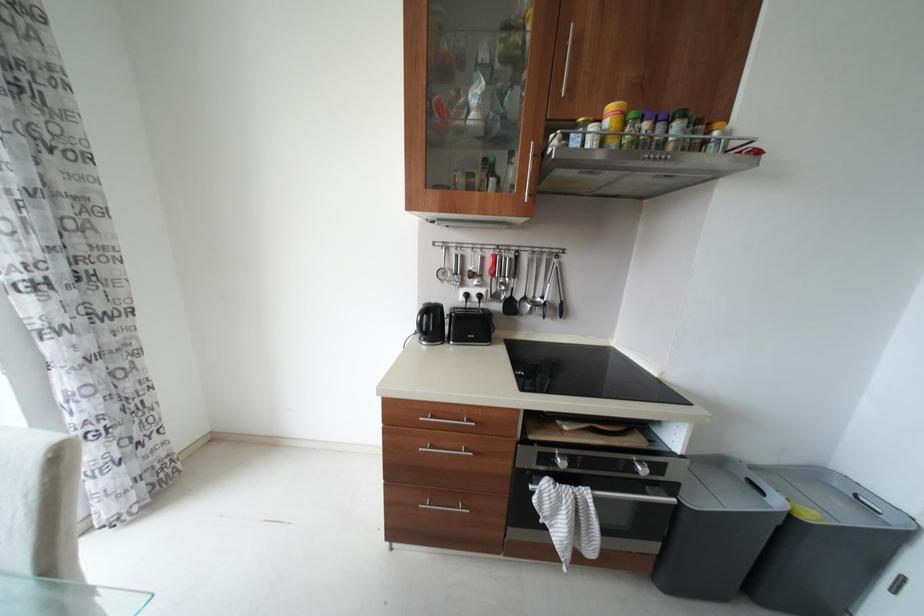
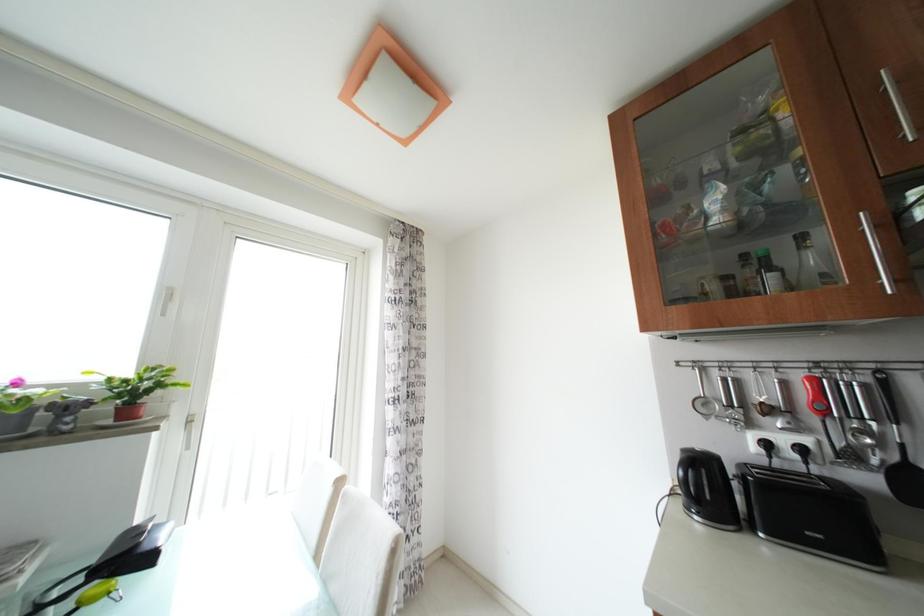
Looking at this image, how did the camera likely rotate?

The camera rotated toward left-up.